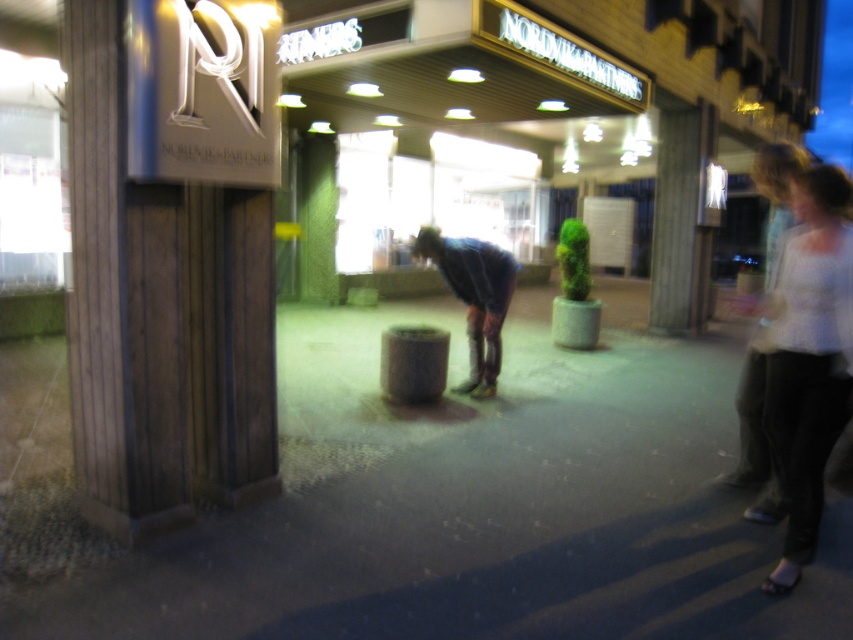
Can you confirm if white knitwear at right is smaller than wooden pillar at center?

Indeed, white knitwear at right has a smaller size compared to wooden pillar at center.

Can you confirm if white knitwear at right is positioned below wooden pillar at center?

Indeed, white knitwear at right is positioned under wooden pillar at center.

This screenshot has width=853, height=640. I want to click on white knitwear at right, so click(807, 355).

Which of these two, wooden sign at left or wooden pillar at center, stands taller?

Standing taller between the two is wooden pillar at center.

Where is `wooden sign at left`? The image size is (853, 640). wooden sign at left is located at coordinates (160, 316).

Can you confirm if white knitwear at right is positioned to the right of blue denim jeans at center?

Indeed, white knitwear at right is positioned on the right side of blue denim jeans at center.

This screenshot has height=640, width=853. Identify the location of white knitwear at right. (807, 355).